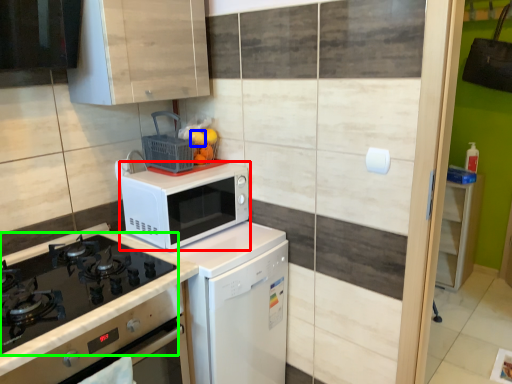
Question: Which is nearer to the microwave oven (highlighted by a red box)? orange (highlighted by a blue box) or gas stove (highlighted by a green box).

Choices:
 (A) orange
 (B) gas stove

Answer: (B)